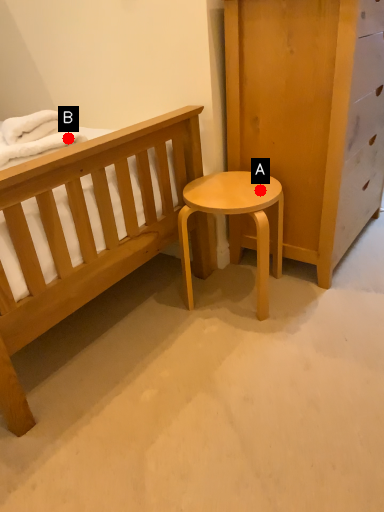
Question: Two points are circled on the image, labeled by A and B beside each circle. Which point appears closest to the camera in this image?

Choices:
 (A) A is closer
 (B) B is closer

Answer: (B)